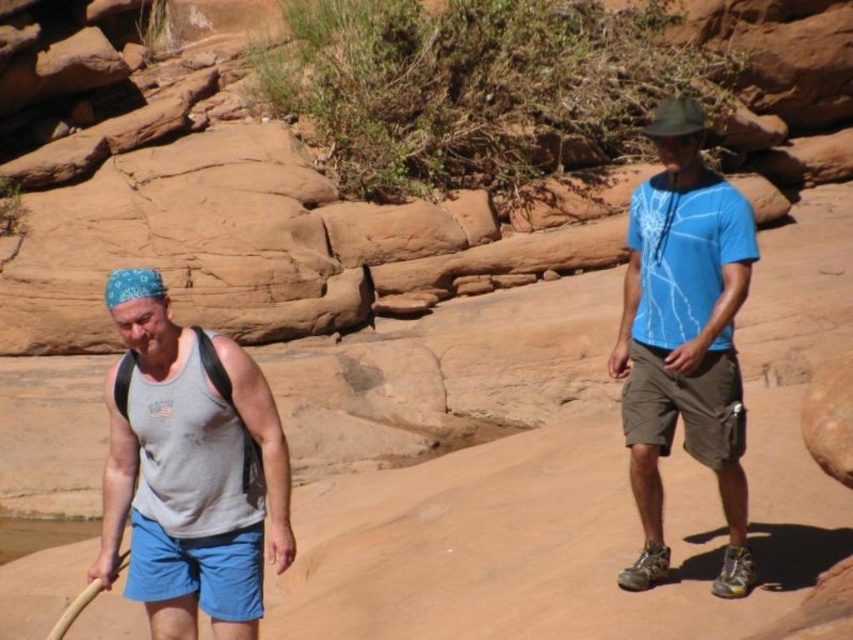
From the picture: You are a photographer trying to capture the gray cotton tank top at left in the center of your camera frame. Given its current position at point coordinates, can you confirm if it is already centered?

The gray cotton tank top at left is located at point coordinates, so it is not centered in the frame.

You are standing at the point marked as point (281, 515) in the desert scene. You need to walk to the nearest water source, which is located 5 meters away from your current position. Can you safely reach it without exceeding the 5 meter limit?

The distance of point (281, 515) from viewer is 6.55 meters, so you are already 6.55 meters away from the viewer. Since the water source is only 5 meters away from your current position, you would have to walk an additional 1.55 meters beyond the 5 meter limit to reach it, making it unsafe to proceed.